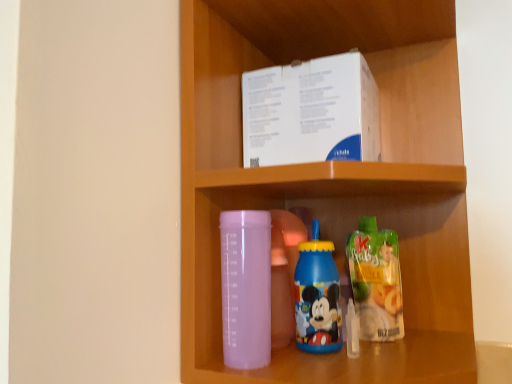
Question: Is transparent plastic bottle at center, the third bottle positioned from the right, to the left of translucent plastic juice at lower right, placed as the third bottle when sorted from left to right, from the viewer's perspective?

Choices:
 (A) no
 (B) yes

Answer: (B)

Question: Does transparent plastic bottle at center, the third bottle positioned from the right, contain translucent plastic juice at lower right, which is the 1th bottle in right-to-left order?

Choices:
 (A) yes
 (B) no

Answer: (B)

Question: Is transparent plastic bottle at center, the third bottle positioned from the right, positioned with its back to translucent plastic juice at lower right, which is the 1th bottle in right-to-left order?

Choices:
 (A) yes
 (B) no

Answer: (B)

Question: Does transparent plastic bottle at center, the first bottle positioned from the left, lie in front of translucent plastic juice at lower right, placed as the third bottle when sorted from left to right?

Choices:
 (A) no
 (B) yes

Answer: (B)

Question: Considering the relative sizes of transparent plastic bottle at center, the third bottle positioned from the right, and translucent plastic juice at lower right, placed as the third bottle when sorted from left to right, in the image provided, is transparent plastic bottle at center, the third bottle positioned from the right, bigger than translucent plastic juice at lower right, placed as the third bottle when sorted from left to right,?

Choices:
 (A) yes
 (B) no

Answer: (A)

Question: Choose the correct answer: Is blue plastic bottle at center, the 2th bottle in the left-to-right sequence, inside translucent plastic juice at lower right, placed as the third bottle when sorted from left to right, or outside it?

Choices:
 (A) outside
 (B) inside

Answer: (A)

Question: Considering the positions of point (315, 278) and point (393, 276), is point (315, 278) closer or farther from the camera than point (393, 276)?

Choices:
 (A) closer
 (B) farther

Answer: (A)

Question: From a real-world perspective, is blue plastic bottle at center, the 2th bottle in the left-to-right sequence, physically located above or below translucent plastic juice at lower right, which is the 1th bottle in right-to-left order?

Choices:
 (A) below
 (B) above

Answer: (B)

Question: Considering the relative positions of blue plastic bottle at center, the 2th bottle in the left-to-right sequence, and translucent plastic juice at lower right, placed as the third bottle when sorted from left to right, in the image provided, is blue plastic bottle at center, the 2th bottle in the left-to-right sequence, to the left or to the right of translucent plastic juice at lower right, placed as the third bottle when sorted from left to right,?

Choices:
 (A) left
 (B) right

Answer: (A)

Question: Based on their sizes in the image, would you say matte plastic bottle at lower center is bigger or smaller than white paperboard box at upper center?

Choices:
 (A) small
 (B) big

Answer: (B)

Question: From a real-world perspective, is matte plastic bottle at lower center above or below white paperboard box at upper center?

Choices:
 (A) above
 (B) below

Answer: (B)

Question: Considering the positions of matte plastic bottle at lower center and white paperboard box at upper center in the image, is matte plastic bottle at lower center taller or shorter than white paperboard box at upper center?

Choices:
 (A) short
 (B) tall

Answer: (B)

Question: In terms of width, does matte plastic bottle at lower center look wider or thinner when compared to white paperboard box at upper center?

Choices:
 (A) thin
 (B) wide

Answer: (B)

Question: From a real-world perspective, relative to matte plastic bottle at lower center, is translucent plastic juice at lower right, which is the 1th bottle in right-to-left order, vertically above or below?

Choices:
 (A) above
 (B) below

Answer: (B)

Question: Is point (396, 337) positioned closer to the camera than point (287, 31)?

Choices:
 (A) closer
 (B) farther

Answer: (A)